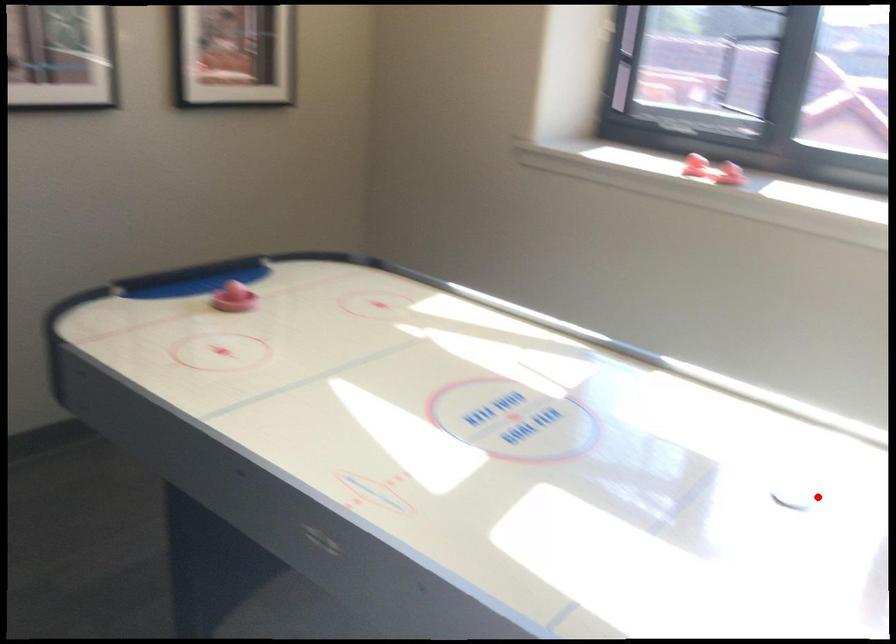
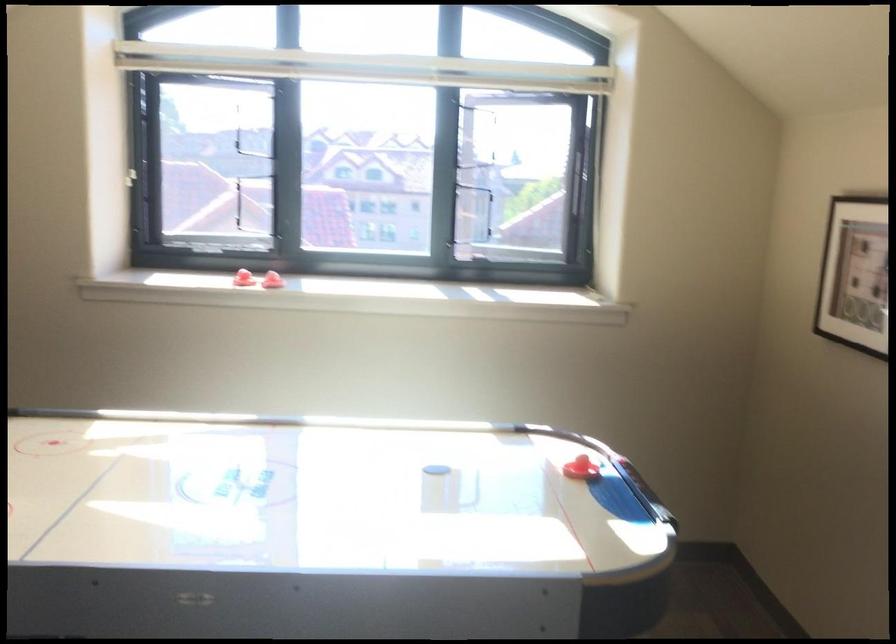
Question: A red point is marked in image1. In image2, is the corresponding 3D point closer to the camera or farther? Reply with the corresponding letter.

Choices:
 (A) The corresponding 3D point is closer.
 (B) The corresponding 3D point is farther.

Answer: (B)